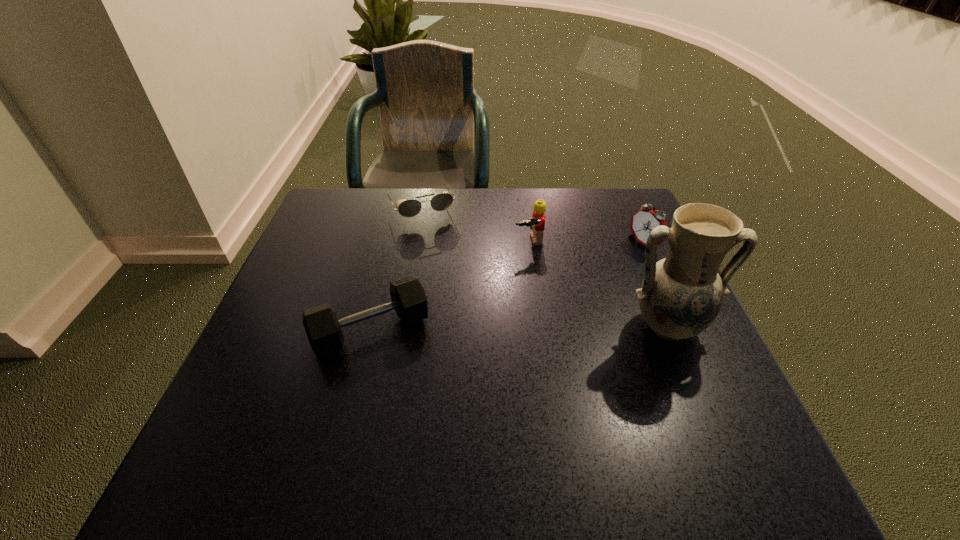
The image size is (960, 540). Find the location of `empty space that is in between the pottery and the Lego`. empty space that is in between the pottery and the Lego is located at coordinates (598, 284).

Image resolution: width=960 pixels, height=540 pixels. In order to click on vacant space in between the pottery and the third object from left to right in this screenshot , I will do `click(598, 284)`.

I want to click on empty space between the shortest object and the Lego, so click(x=474, y=224).

Image resolution: width=960 pixels, height=540 pixels. Identify the location of free space between the tallest object and the fourth tallest object. (519, 328).

The width and height of the screenshot is (960, 540). What are the coordinates of `vacant region between the second shortest object and the third object from left to right` in the screenshot? It's located at (450, 286).

Where is `vacant space that's between the fourth tallest object and the Lego`? This screenshot has width=960, height=540. vacant space that's between the fourth tallest object and the Lego is located at coordinates (450, 286).

Locate an element on the screen. Image resolution: width=960 pixels, height=540 pixels. vacant space that is in between the third object from right to left and the shortest object is located at coordinates 474,224.

In order to click on vacant area between the fourth tallest object and the alarm clock in this screenshot , I will do `click(507, 287)`.

At what (x,y) coordinates should I click in order to perform the action: click on blank region between the second shortest object and the shortest object. Please return your answer as a coordinate pair (x, y). Looking at the image, I should click on (396, 269).

At what (x,y) coordinates should I click in order to perform the action: click on object that stands as the closest to the alarm clock. Please return your answer as a coordinate pair (x, y). The height and width of the screenshot is (540, 960). Looking at the image, I should click on (681, 295).